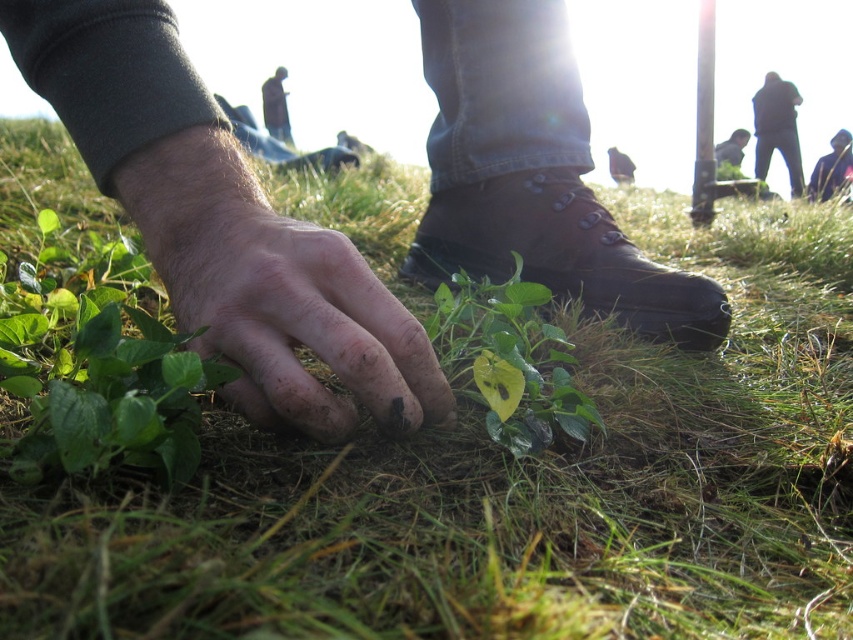
Question: From the image, what is the correct spatial relationship of muddy skin at center in relation to dark matte jacket at upper right?

Choices:
 (A) left
 (B) right

Answer: (A)

Question: Which of these objects is positioned closest to the dirty skin hand at center?

Choices:
 (A) dark brown leather jacket at upper center
 (B) leather boot at center

Answer: (B)

Question: Among these objects, which one is nearest to the camera?

Choices:
 (A) dark matte jacket at upper right
 (B) dirty skin hand at center
 (C) leather boot at center

Answer: (C)

Question: Is dark blue jacket at lower right thinner than dark gray fabric at lower right?

Choices:
 (A) no
 (B) yes

Answer: (A)

Question: Which point appears farthest from the camera in this image?

Choices:
 (A) (264, 307)
 (B) (488, 29)

Answer: (B)

Question: Is leather boot at center positioned at the back of dark gray fabric at lower right?

Choices:
 (A) no
 (B) yes

Answer: (A)